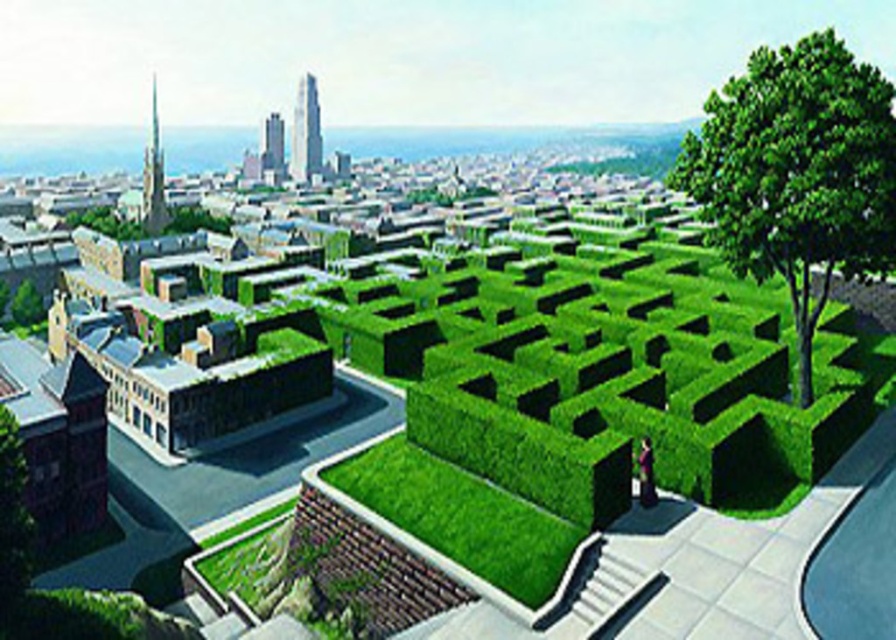
You are standing at the entrance of the hedge maze and want to locate the green leafy tree at upper right. According to the coordinates provided, where should you look relative to your position?

The green leafy tree at upper right is located at coordinates point (797, 173), which means it is positioned to the upper right relative to your current position at the maze entrance.

You are a drone operator trying to capture a photo of the green leafy tree at upper right and the green hedge at center. Which object should you adjust your camera angle upwards to focus on?

The green leafy tree at upper right is above the green hedge at center, so you should adjust your camera angle upwards to focus on the green leafy tree at upper right.

You are standing at the entrance of the hedge maze and want to reach a specific point marked at coordinates point (867, 128). If your current position is 10 feet away from the camera, can you estimate whether the target point is closer to or farther from the camera compared to your current position?

The distance of point (867, 128) from camera is 145.16 feet. Since your current position is only 10 feet away from the camera, the target point is much farther from the camera than your current position.